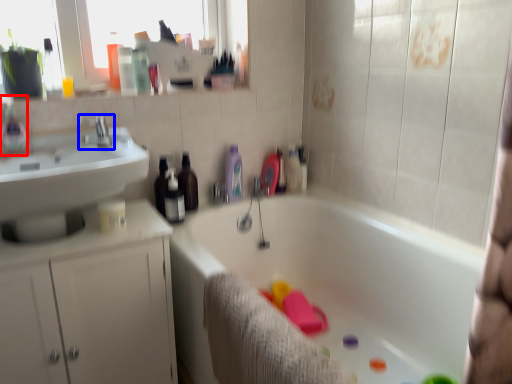
Question: Among these objects, which one is farthest to the camera, bottle (highlighted by a red box) or tap (highlighted by a blue box)?

Choices:
 (A) bottle
 (B) tap

Answer: (B)